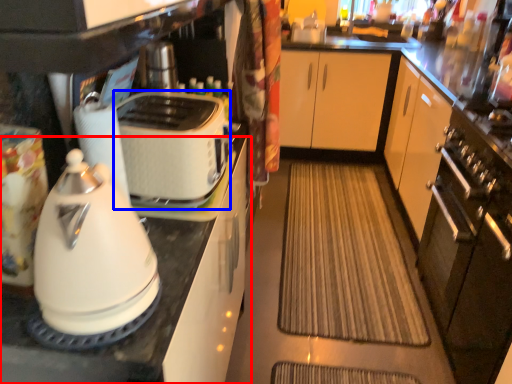
Question: Which point is further to the camera, cabinetry (highlighted by a red box) or toaster (highlighted by a blue box)?

Choices:
 (A) cabinetry
 (B) toaster

Answer: (B)